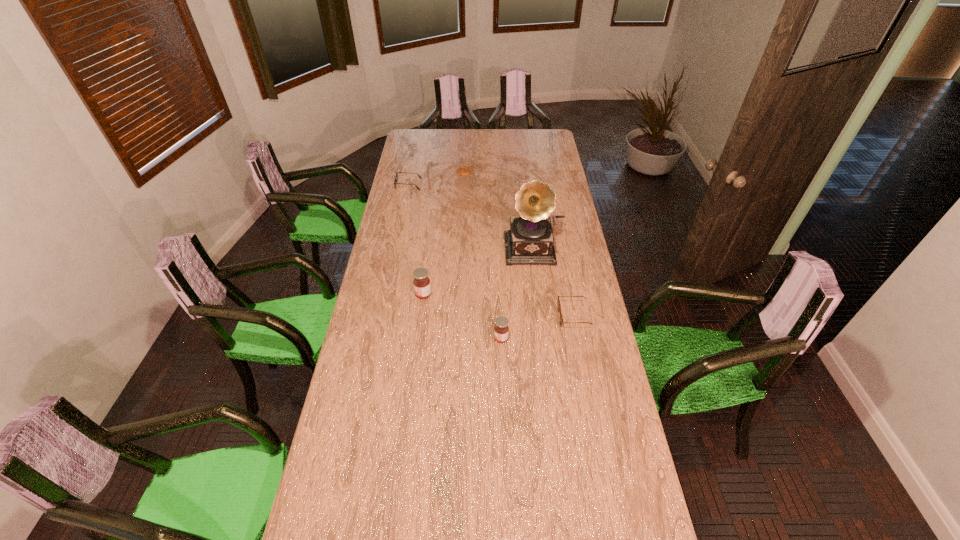
Locate an element on the screen. The height and width of the screenshot is (540, 960). empty location between the farther spectacles and the third object from left to right is located at coordinates (437, 178).

The height and width of the screenshot is (540, 960). I want to click on free space between the taller jam and the left spectacles, so click(416, 239).

Identify the location of vacant area that lies between the left spectacles and the fourth object from right to left. The image size is (960, 540). (437, 178).

You are a GUI agent. You are given a task and a screenshot of the screen. Output one action in this format:
    pyautogui.click(x=<x>, y=<y>)
    Task: Click on the unoccupied area between the third object from right to left and the fifth nearest object
    The height and width of the screenshot is (540, 960).
    Given the screenshot: What is the action you would take?
    pyautogui.click(x=455, y=261)

Identify the location of vacant area between the nearer spectacles and the record player. (555, 282).

Where is `free area in between the right spectacles and the fourth shortest object`? This screenshot has width=960, height=540. free area in between the right spectacles and the fourth shortest object is located at coordinates pos(538,327).

This screenshot has width=960, height=540. In order to click on free space between the right jam and the right spectacles in this screenshot , I will do `click(538, 327)`.

I want to click on empty location between the leftmost object and the shorter jam, so click(455, 261).

Image resolution: width=960 pixels, height=540 pixels. Identify the location of empty location between the fifth shortest object and the second nearest object. (498, 306).

Select which object is the closest to the third farthest object. Please provide its 2D coordinates. Your answer should be formatted as a tuple, i.e. [(x, y)], where the tuple contains the x and y coordinates of a point satisfying the conditions above.

[(558, 301)]